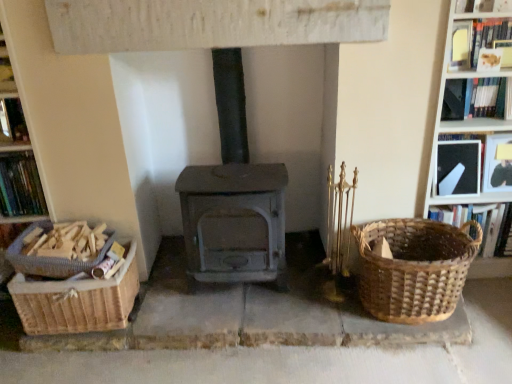
Where is `vacant area that lies between gray matte wood burning stove at center and woven brown basket at lower left`? This screenshot has height=384, width=512. vacant area that lies between gray matte wood burning stove at center and woven brown basket at lower left is located at coordinates [174, 293].